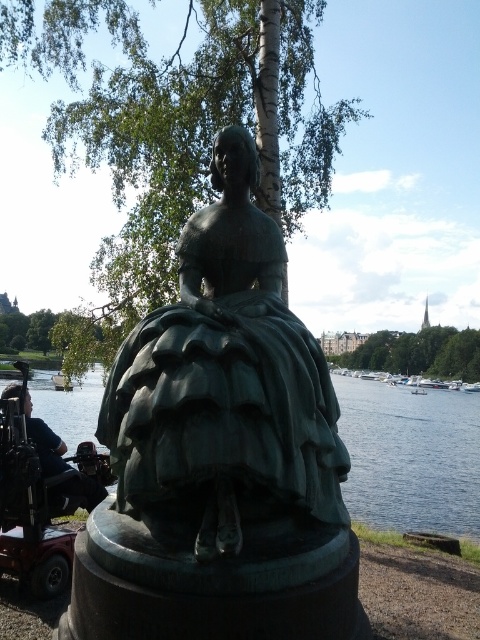
Does green bronze statue at center appear on the right side of metallic red mobility scooter at lower left?

Yes, green bronze statue at center is to the right of metallic red mobility scooter at lower left.

Does green bronze statue at center have a smaller size compared to metallic red mobility scooter at lower left?

Yes.

Image resolution: width=480 pixels, height=640 pixels. Find the location of `green bronze statue at center`. green bronze statue at center is located at coordinates click(x=410, y=458).

Does point (226, 131) come in front of point (94, 422)?

That is True.

What do you see at coordinates (225, 378) in the screenshot? I see `green patina statue at center` at bounding box center [225, 378].

I want to click on green patina statue at center, so click(225, 378).

Does green patina statue at center have a greater width compared to metallic red mobility scooter at lower left?

Yes, green patina statue at center is wider than metallic red mobility scooter at lower left.

From the picture: Does green patina statue at center have a larger size compared to metallic red mobility scooter at lower left?

Yes, green patina statue at center is bigger than metallic red mobility scooter at lower left.

Does point (334, 420) come closer to viewer compared to point (39, 566)?

Yes, it is in front of point (39, 566).

At what (x,y) coordinates should I click in order to perform the action: click on green patina statue at center. Please return your answer as a coordinate pair (x, y). The height and width of the screenshot is (640, 480). Looking at the image, I should click on (225, 378).